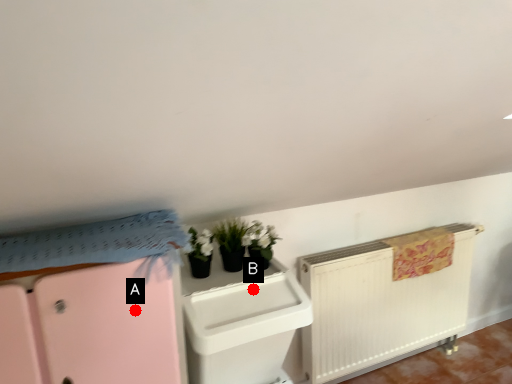
Question: Two points are circled on the image, labeled by A and B beside each circle. Among these points, which one is nearest to the camera?

Choices:
 (A) A is closer
 (B) B is closer

Answer: (A)